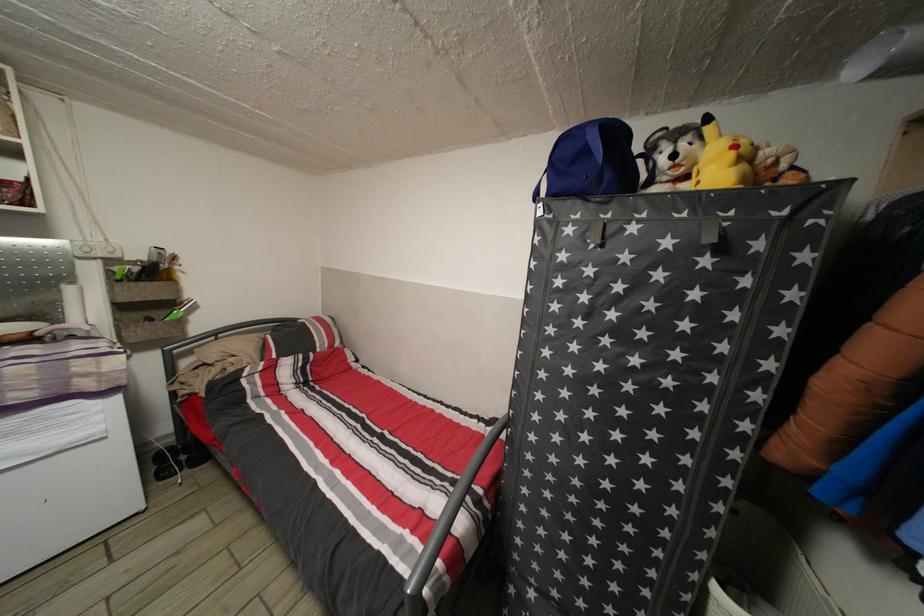
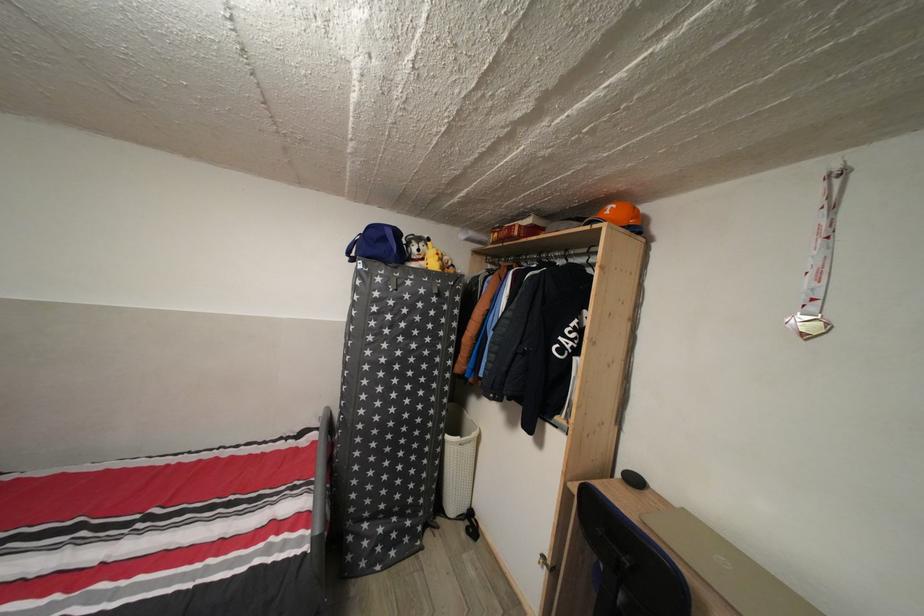
In the second image, find the point that corresponds to [738,161] in the first image.

(444, 264)